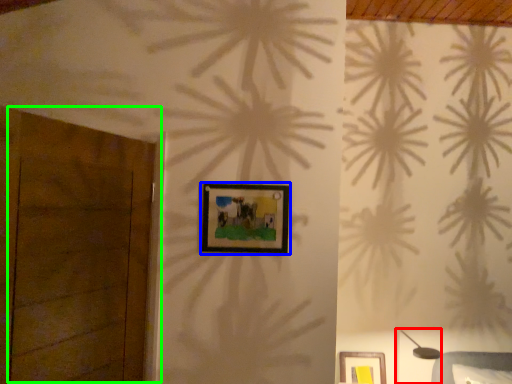
Question: Considering the real-world distances, which object is closest to table lamp (highlighted by a red box)? picture frame (highlighted by a blue box) or door (highlighted by a green box).

Choices:
 (A) picture frame
 (B) door

Answer: (A)